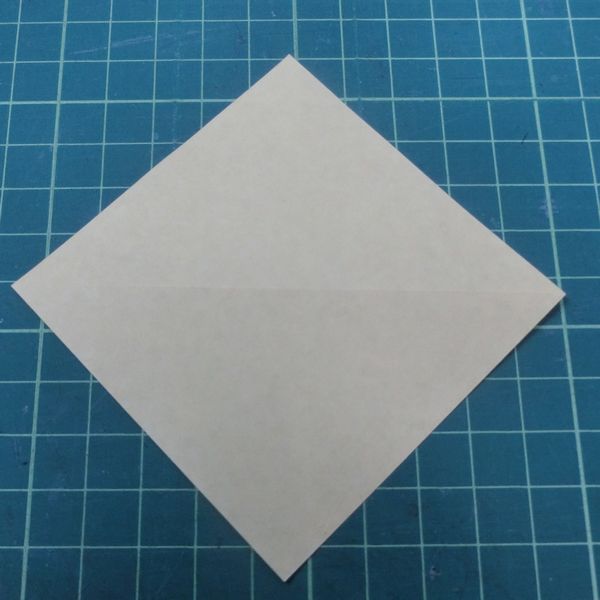
Identify the location of grout lines. (576, 430).